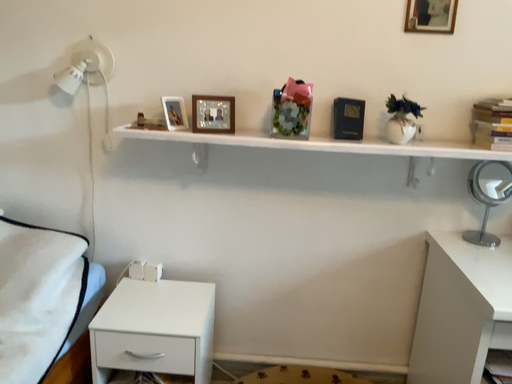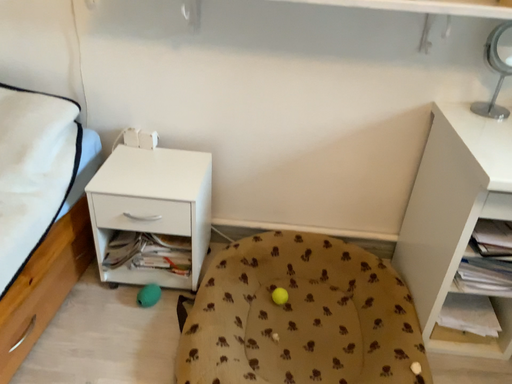
Question: Which way did the camera rotate in the video?

Choices:
 (A) rotated upward
 (B) rotated downward

Answer: (B)